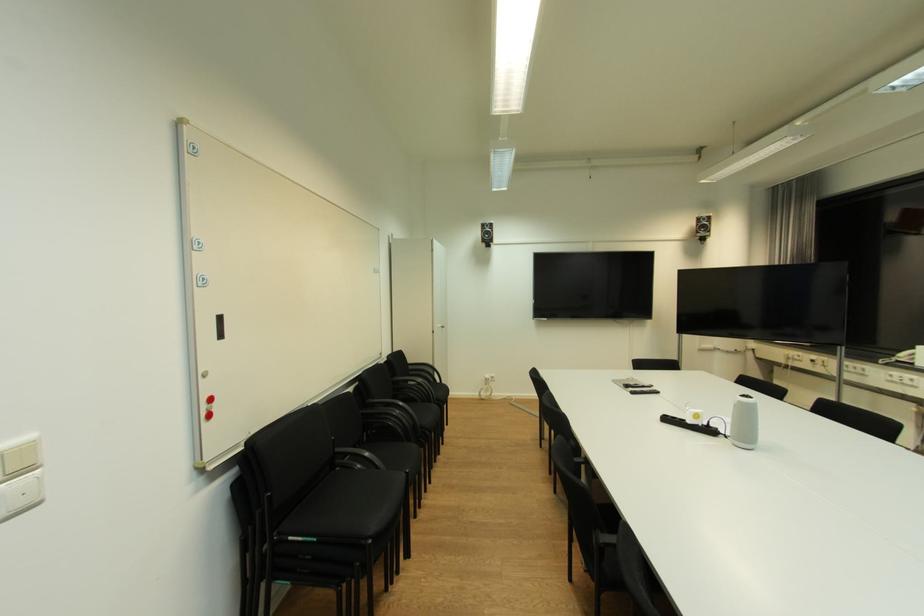
Describe the element at coordinates (203, 373) in the screenshot. I see `the white cabinet handle` at that location.